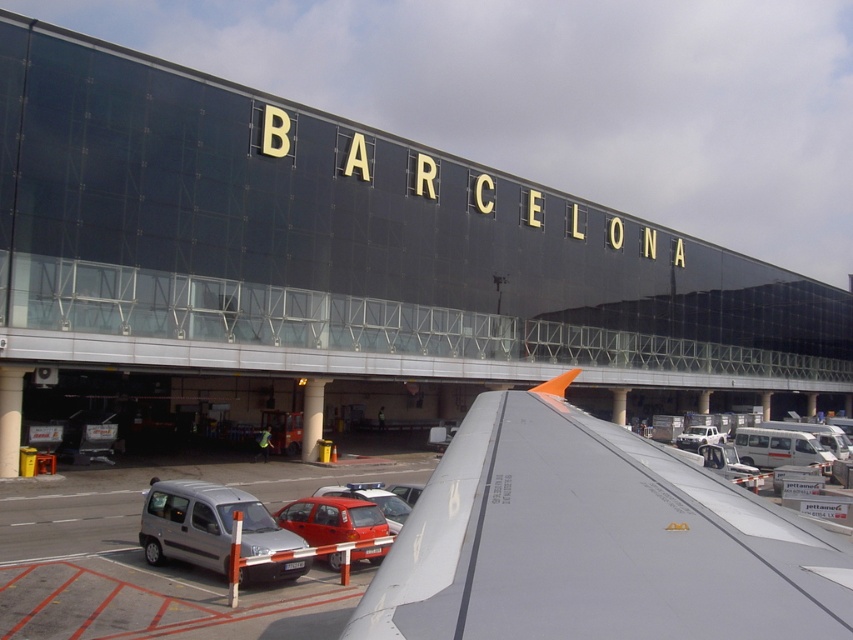
Question: Does concrete pillar at center have a lesser width compared to gray concrete pillar at center?

Choices:
 (A) yes
 (B) no

Answer: (A)

Question: Which of the following is the farthest from the observer?

Choices:
 (A) white matte truck at upper right
 (B) gray concrete pillar at center
 (C) yellow painted concrete pillar at center

Answer: (B)

Question: Can you confirm if silver metallic van at lower left is positioned above concrete pillar at center?

Choices:
 (A) yes
 (B) no

Answer: (A)

Question: Which of the following is the closest to the observer?

Choices:
 (A) (245, 577)
 (B) (4, 451)
 (C) (41, 250)
 (D) (389, 522)

Answer: (A)

Question: Can you confirm if matte red car at center is positioned to the left of gray concrete pillar at center?

Choices:
 (A) no
 (B) yes

Answer: (B)

Question: Which object is farther from the camera taking this photo?

Choices:
 (A) silver metallic van at lower left
 (B) matte red hatchback at center
 (C) black glass airport terminal at center

Answer: (C)